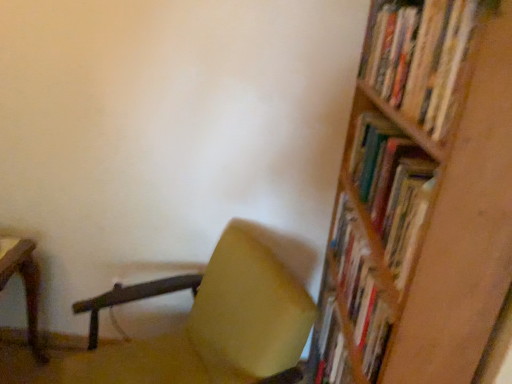
Question: In the image, is wooden bookshelf at right positioned in front of or behind matte yellow chair at center?

Choices:
 (A) behind
 (B) front

Answer: (B)

Question: From a real-world perspective, relative to matte yellow chair at center, is wooden bookshelf at right vertically above or below?

Choices:
 (A) above
 (B) below

Answer: (A)

Question: Which of these objects is positioned farthest from the wooden bookshelf at upper right?

Choices:
 (A) matte yellow chair at center
 (B) wooden bookshelf at right

Answer: (A)

Question: Which object is positioned farthest from the wooden bookshelf at upper right?

Choices:
 (A) matte yellow chair at center
 (B) wooden bookshelf at right

Answer: (A)